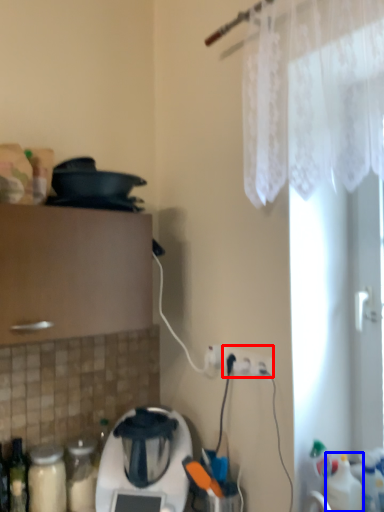
Question: Which object is further to the camera taking this photo, electric outlet (highlighted by a red box) or bottle (highlighted by a blue box)?

Choices:
 (A) electric outlet
 (B) bottle

Answer: (A)